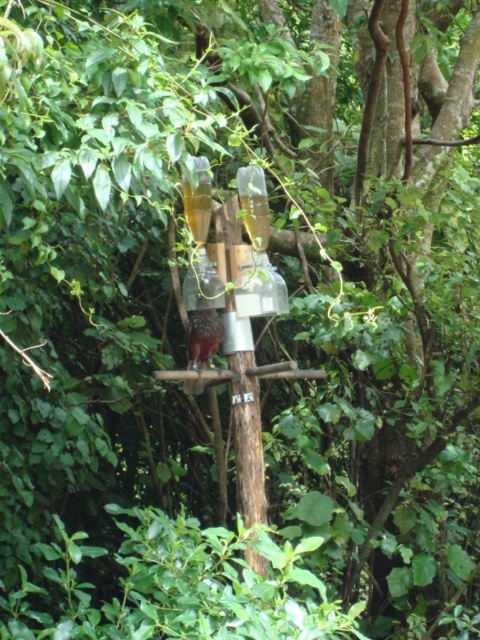
Is transparent glass bottle at center below brown speckled feathers at center?

No, transparent glass bottle at center is not below brown speckled feathers at center.

Is transparent glass bottle at center to the left of brown speckled feathers at center from the viewer's perspective?

In fact, transparent glass bottle at center is to the right of brown speckled feathers at center.

Is point (200, 304) in front of point (217, 349)?

Yes, point (200, 304) is in front of point (217, 349).

The width and height of the screenshot is (480, 640). I want to click on transparent glass bottle at center, so click(x=203, y=284).